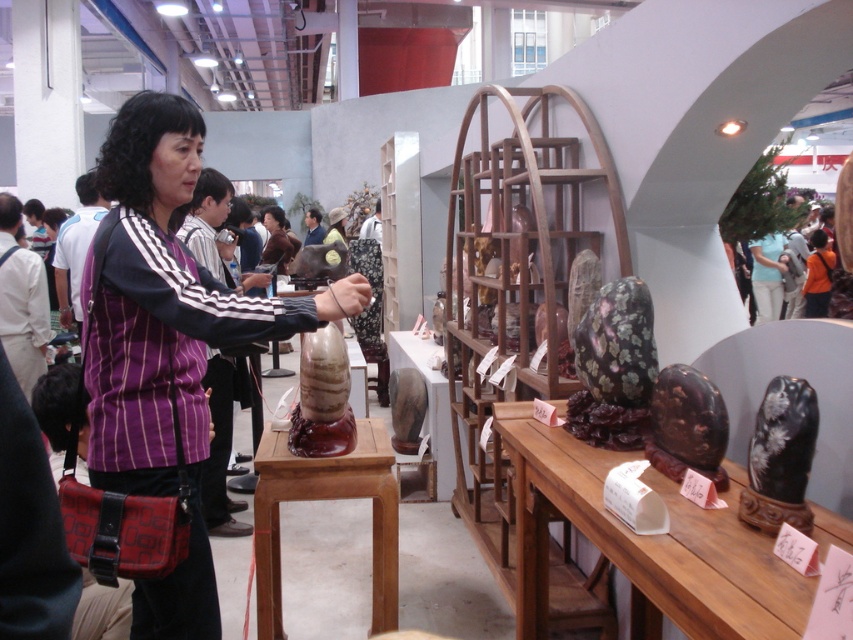
You are a photographer at the exhibition. You want to take a photo of the brown polished wood stool at center without the purple striped shirt at center blocking it. What should you do?

Move the camera backward to capture the brown polished wood stool at center without the purple striped shirt at center in the frame.

You are a photographer setting up a shoot in the exhibition space. You have a camera with a 12x18 inch backdrop. You need to place both the purple striped shirt at center and the brown polished wood stool at center behind the backdrop. Can both items fit side by side within the backdrop without overlapping?

The purple striped shirt at center is bigger than the brown polished wood stool at center. Since the backdrop is 12x18 inches, the combined width of both items must be less than or equal to 18 inches. However, without knowing their exact dimensions, we cannot confirm if they will fit. The photographer should measure both items to ensure they fit within the backdrop dimensions.

You are a photographer at the exhibition and want to capture a photo of the purple striped shirt at center and the brown polished wood stool at center. If you want to ensure both objects are fully visible in the frame, which object should you position closer to the camera to avoid cropping?

The purple striped shirt at center is taller than the brown polished wood stool at center, so positioning the purple striped shirt at center closer to the camera will help ensure both are fully visible without cropping.